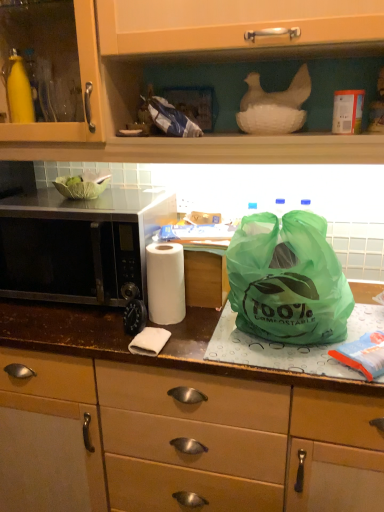
This screenshot has width=384, height=512. Describe the element at coordinates (200, 438) in the screenshot. I see `green plastic bag at center, acting as the 2th cabinetry starting from the top` at that location.

Identify the location of green plastic bag at center, the first cabinetry in the bottom-to-top sequence. (200, 438).

I want to click on black matte microwave at left, so click(80, 245).

At what (x,y) coordinates should I click in order to perform the action: click on matte wood cabinet at upper center, placed as the second cabinetry when sorted from bottom to top. Please return your answer as a coordinate pair (x, y). The width and height of the screenshot is (384, 512). Looking at the image, I should click on (196, 60).

What are the coordinates of `paper towel behind the matte wood cabinet at upper center, placed as the second cabinetry when sorted from bottom to top` in the screenshot? It's located at (165, 283).

Does white matte paper towel at center have a smaller size compared to matte wood cabinet at upper center, placed as the second cabinetry when sorted from bottom to top?

Yes.

Between white matte paper towel at center and matte wood cabinet at upper center, the first cabinetry from the top, which one has smaller width?

With smaller width is white matte paper towel at center.

Are white matte paper towel at center and matte wood cabinet at upper center, placed as the second cabinetry when sorted from bottom to top, beside each other?

No, white matte paper towel at center is not in contact with matte wood cabinet at upper center, placed as the second cabinetry when sorted from bottom to top.

Based on the photo, from a real-world perspective, who is located lower, green compostable bag at center or matte wood cabinet at upper center, the first cabinetry from the top?

green compostable bag at center is physically lower.

In the image, is green compostable bag at center on the left side or the right side of matte wood cabinet at upper center, placed as the second cabinetry when sorted from bottom to top?

Based on their positions, green compostable bag at center is located to the right of matte wood cabinet at upper center, placed as the second cabinetry when sorted from bottom to top.

Is green compostable bag at center in contact with matte wood cabinet at upper center, the first cabinetry from the top?

No, green compostable bag at center is not making contact with matte wood cabinet at upper center, the first cabinetry from the top.

Based on the photo, is matte wood cabinet at upper center, placed as the second cabinetry when sorted from bottom to top, at the back of green compostable bag at center?

green compostable bag at center does not have its back to matte wood cabinet at upper center, placed as the second cabinetry when sorted from bottom to top.

In the scene shown: From the image's perspective, is green plastic bag at center, acting as the 2th cabinetry starting from the top, located above or below green compostable bag at center?

From the image's perspective, green plastic bag at center, acting as the 2th cabinetry starting from the top, appears below green compostable bag at center.

Are green plastic bag at center, acting as the 2th cabinetry starting from the top, and green compostable bag at center far apart?

Actually, green plastic bag at center, acting as the 2th cabinetry starting from the top, and green compostable bag at center are a little close together.

How distant is green plastic bag at center, the first cabinetry in the bottom-to-top sequence, from green compostable bag at center?

They are 12.52 inches apart.

Between green plastic bag at center, the first cabinetry in the bottom-to-top sequence, and green compostable bag at center, which one appears on the left side from the viewer's perspective?

Positioned to the left is green plastic bag at center, the first cabinetry in the bottom-to-top sequence.

From a real-world perspective, is matte wood cabinet at upper center, the first cabinetry from the top, physically below green compostable bag at center?

Actually, matte wood cabinet at upper center, the first cabinetry from the top, is physically above green compostable bag at center in the real world.

Is matte wood cabinet at upper center, placed as the second cabinetry when sorted from bottom to top, spatially inside green compostable bag at center, or outside of it?

matte wood cabinet at upper center, placed as the second cabinetry when sorted from bottom to top, is outside green compostable bag at center.

Which object is positioned more to the left, white matte paper towel at center or green compostable bag at center?

From the viewer's perspective, white matte paper towel at center appears more on the left side.

How different are the orientations of white matte paper towel at center and green compostable bag at center in degrees?

They differ by 1.7 degrees in their facing directions.

Which of these two, white matte paper towel at center or green compostable bag at center, is wider?

Wider between the two is green compostable bag at center.

From the image's perspective, which is above, white matte paper towel at center or green compostable bag at center?

green compostable bag at center, from the image's perspective.

Which object is wider, white matte paper towel at center or green plastic bag at center, the first cabinetry in the bottom-to-top sequence?

green plastic bag at center, the first cabinetry in the bottom-to-top sequence.

Based on their positions, is white matte paper towel at center located to the left or right of green plastic bag at center, acting as the 2th cabinetry starting from the top?

From the image, it's evident that white matte paper towel at center is to the left of green plastic bag at center, acting as the 2th cabinetry starting from the top.

Is white matte paper towel at center far away from green plastic bag at center, acting as the 2th cabinetry starting from the top?

No, there isn't a large distance between white matte paper towel at center and green plastic bag at center, acting as the 2th cabinetry starting from the top.

Who is bigger, green compostable bag at center or white matte paper towel at center?

Bigger between the two is green compostable bag at center.

Can you tell me how much green compostable bag at center and white matte paper towel at center differ in facing direction?

1.7 degrees separate the facing orientations of green compostable bag at center and white matte paper towel at center.

Is green compostable bag at center spatially inside white matte paper towel at center, or outside of it?

green compostable bag at center is not enclosed by white matte paper towel at center.

Measure the distance between green compostable bag at center and white matte paper towel at center.

The distance of green compostable bag at center from white matte paper towel at center is 10.70 inches.

Locate an element on the screen. This screenshot has width=384, height=512. paper towel below the matte wood cabinet at upper center, the first cabinetry from the top (from a real-world perspective) is located at coordinates (165, 283).

Where is `cabinetry above the green compostable bag at center (from the image's perspective)`? The image size is (384, 512). cabinetry above the green compostable bag at center (from the image's perspective) is located at coordinates (196, 60).

Based on the photo, estimate the real-world distances between objects in this image. Which object is further from green plastic bag at center, the first cabinetry in the bottom-to-top sequence, green compostable bag at center or white matte paper towel at center?

white matte paper towel at center.

Looking at the image, which one is located further to white matte paper towel at center, green plastic bag at center, the first cabinetry in the bottom-to-top sequence, or black matte microwave at left?

green plastic bag at center, the first cabinetry in the bottom-to-top sequence, is further to white matte paper towel at center.

Which object lies further to the anchor point green plastic bag at center, the first cabinetry in the bottom-to-top sequence, black matte microwave at left or green compostable bag at center?

Among the two, black matte microwave at left is located further to green plastic bag at center, the first cabinetry in the bottom-to-top sequence.

Looking at the image, which one is located closer to green compostable bag at center, matte wood cabinet at upper center, the first cabinetry from the top, or green plastic bag at center, acting as the 2th cabinetry starting from the top?

The object closer to green compostable bag at center is green plastic bag at center, acting as the 2th cabinetry starting from the top.

Looking at the image, which one is located closer to matte wood cabinet at upper center, placed as the second cabinetry when sorted from bottom to top, green plastic bag at center, the first cabinetry in the bottom-to-top sequence, or black matte microwave at left?

Among the two, black matte microwave at left is located nearer to matte wood cabinet at upper center, placed as the second cabinetry when sorted from bottom to top.

When comparing their distances from black matte microwave at left, does green plastic bag at center, acting as the 2th cabinetry starting from the top, or matte wood cabinet at upper center, placed as the second cabinetry when sorted from bottom to top, seem further?

Based on the image, green plastic bag at center, acting as the 2th cabinetry starting from the top, appears to be further to black matte microwave at left.

When comparing their distances from matte wood cabinet at upper center, the first cabinetry from the top, does white matte paper towel at center or green compostable bag at center seem closer?

green compostable bag at center is closer to matte wood cabinet at upper center, the first cabinetry from the top.

Based on their spatial positions, is black matte microwave at left or green plastic bag at center, acting as the 2th cabinetry starting from the top, further from white matte paper towel at center?

green plastic bag at center, acting as the 2th cabinetry starting from the top.

Identify the location of paper towel between green compostable bag at center and green plastic bag at center, acting as the 2th cabinetry starting from the top, in the up-down direction. (165, 283).

This screenshot has width=384, height=512. Identify the location of paper towel between black matte microwave at left and green compostable bag at center. (165, 283).

You are a GUI agent. You are given a task and a screenshot of the screen. Output one action in this format:
    pyautogui.click(x=<x>, y=<y>)
    Task: Click on the paper towel between matte wood cabinet at upper center, placed as the second cabinetry when sorted from bottom to top, and green plastic bag at center, acting as the 2th cabinetry starting from the top, in the up-down direction
    The height and width of the screenshot is (512, 384).
    Given the screenshot: What is the action you would take?
    pyautogui.click(x=165, y=283)

This screenshot has width=384, height=512. Identify the location of microwave between matte wood cabinet at upper center, the first cabinetry from the top, and green plastic bag at center, acting as the 2th cabinetry starting from the top, in the up-down direction. (80, 245).